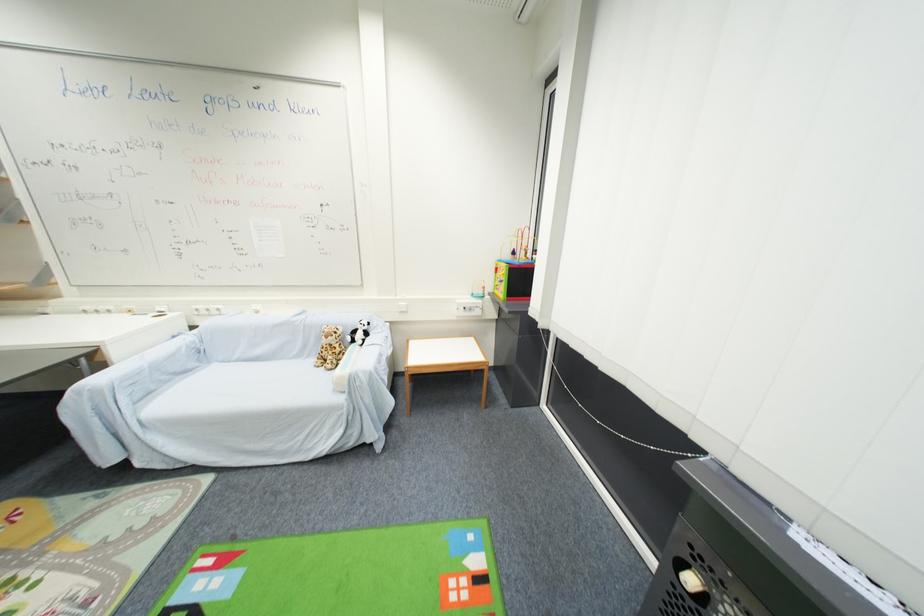
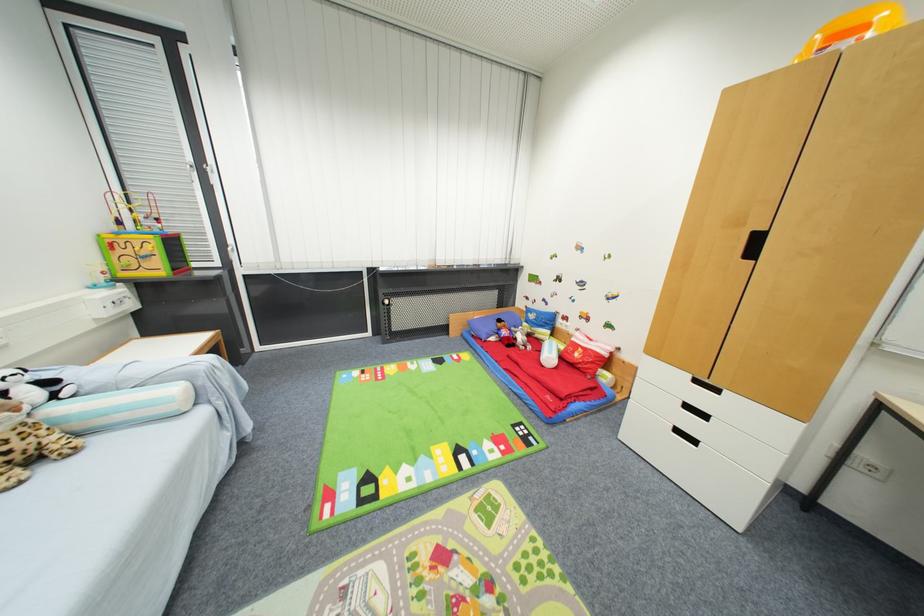
In the second image, find the point that corresponds to point (371, 336) in the first image.

(54, 384)